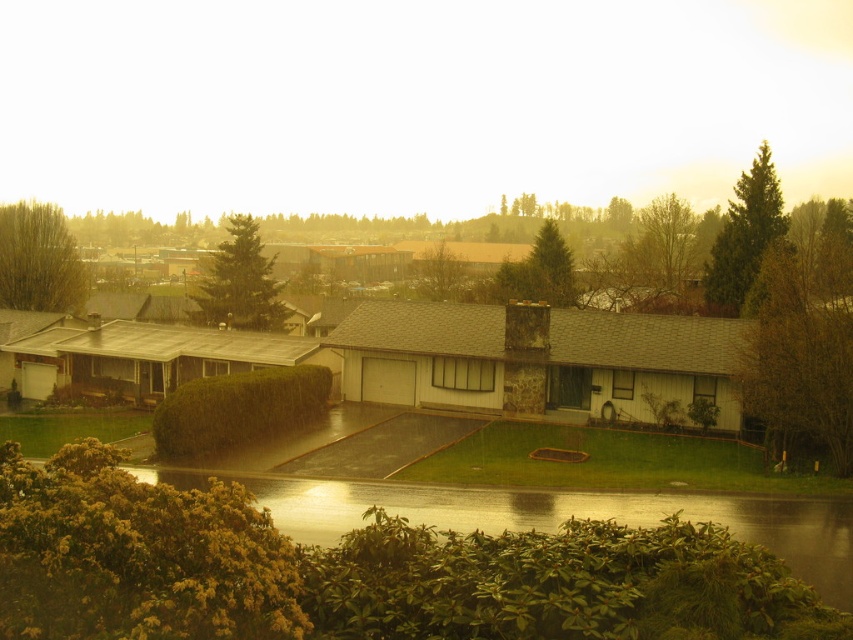
Question: Is green textured tree at upper right smaller than bare branches at upper center?

Choices:
 (A) no
 (B) yes

Answer: (B)

Question: Among these objects, which one is nearest to the camera?

Choices:
 (A) green textured tree at center
 (B) green leafy shrub at lower left
 (C) bare branches at upper center

Answer: (B)

Question: Is green matte tree at center below green leafy tree at center?

Choices:
 (A) no
 (B) yes

Answer: (A)

Question: Which object is the closest to the green leafy tree at center?

Choices:
 (A) green leafy tree at upper left
 (B) green textured tree at center
 (C) bare branches at upper center
 (D) green leafy tree at right

Answer: (C)

Question: Which of the following is the closest to the observer?

Choices:
 (A) green fuzzy bush at lower left
 (B) green textured tree at center
 (C) green leafy tree at upper left
 (D) green textured tree at upper right

Answer: (A)

Question: Can you confirm if bare branches at upper center is positioned to the left of green textured tree at center?

Choices:
 (A) yes
 (B) no

Answer: (B)